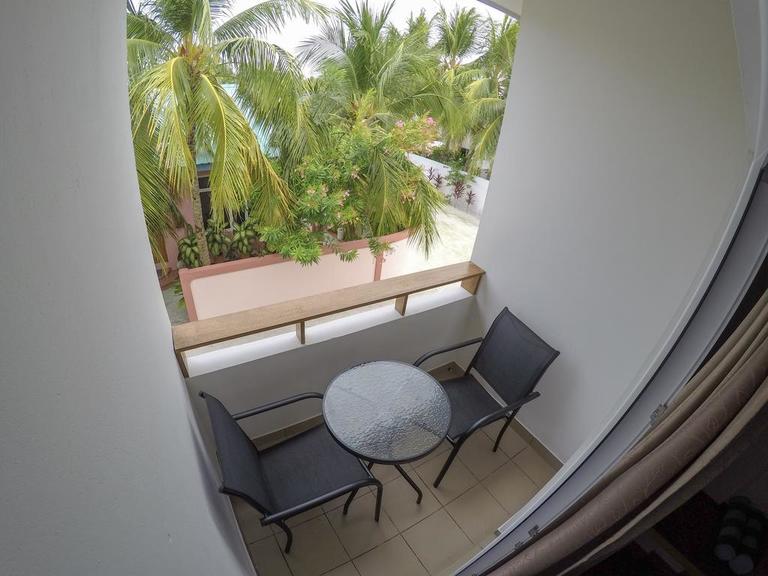
Identify the location of floor tiles. This screenshot has width=768, height=576. (444, 536), (484, 469), (326, 539), (388, 560).